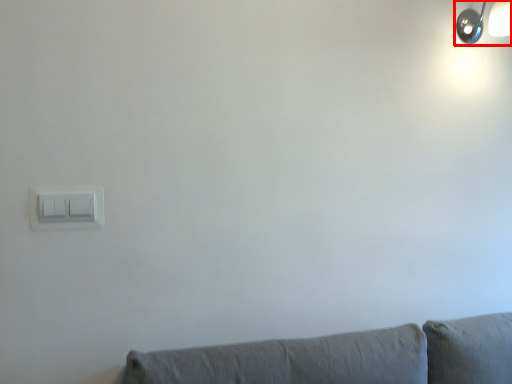
Question: From the image's perspective, considering the relative positions of lamp (annotated by the red box) and light switch in the image provided, where is lamp (annotated by the red box) located with respect to the staircase?

Choices:
 (A) above
 (B) below

Answer: (A)